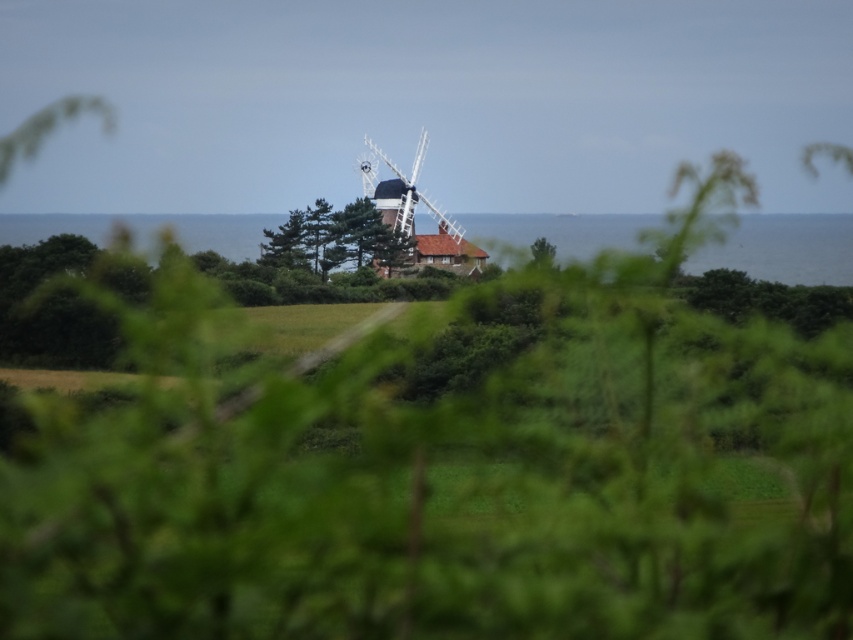
Can you confirm if green leafy tree at center is wider than white wooden windmill at center?

Indeed, green leafy tree at center has a greater width compared to white wooden windmill at center.

Does point (372, 234) come in front of point (413, 156)?

Yes, it is in front of point (413, 156).

Which is behind, point (352, 241) or point (463, 253)?

The point (463, 253) is behind.

The height and width of the screenshot is (640, 853). What are the coordinates of `green leafy tree at center` in the screenshot? It's located at (335, 237).

Is blue water at center to the right of white wooden windmill at center from the viewer's perspective?

Indeed, blue water at center is positioned on the right side of white wooden windmill at center.

Who is more forward, (x=94, y=216) or (x=381, y=179)?

Positioned in front is point (x=381, y=179).

Locate an element on the screen. The width and height of the screenshot is (853, 640). blue water at center is located at coordinates point(784,248).

Which of these two, blue water at center or green leafy tree at center, stands taller?

blue water at center

Is point (827, 234) behind point (328, 225)?

Yes.

What are the coordinates of `blue water at center` in the screenshot? It's located at pos(784,248).